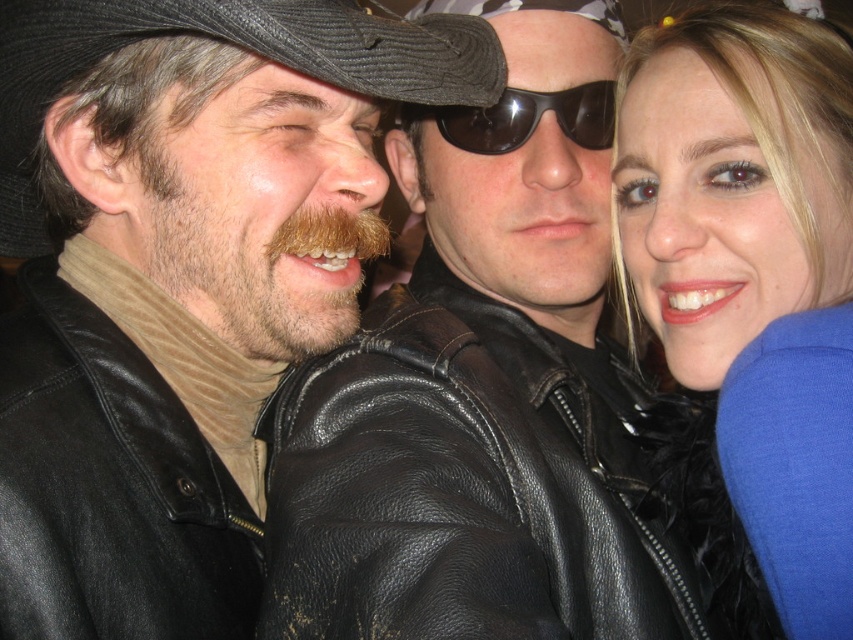
Question: Is black leather jacket at center thinner than black corduroy hat at upper left?

Choices:
 (A) no
 (B) yes

Answer: (B)

Question: Considering the real-world distances, which object is farthest from the black corduroy hat at upper left?

Choices:
 (A) black leather jacket at center
 (B) black matte sunglasses at center
 (C) smooth blue scarf at right

Answer: (A)

Question: Does black corduroy hat at upper left lie behind black matte sunglasses at center?

Choices:
 (A) no
 (B) yes

Answer: (A)

Question: Does smooth blue scarf at right lie in front of black corduroy hat at upper left?

Choices:
 (A) yes
 (B) no

Answer: (A)

Question: Which of these objects is positioned farthest from the brown fuzzy beard at left?

Choices:
 (A) smooth blue scarf at right
 (B) black matte sunglasses at center

Answer: (A)

Question: Which point is farther to the camera?

Choices:
 (A) (221, 317)
 (B) (38, 241)

Answer: (B)